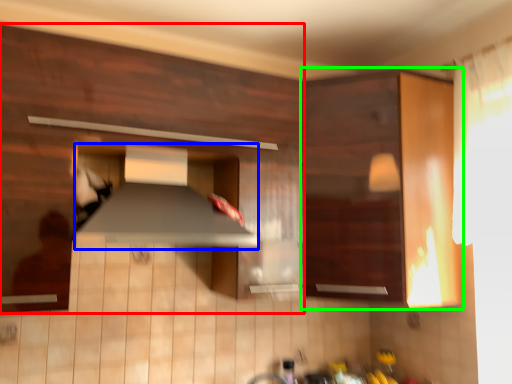
Question: Estimate the real-world distances between objects in this image. Which object is closer to cabinetry (highlighted by a red box), exhaust hood (highlighted by a blue box) or cabinetry (highlighted by a green box)?

Choices:
 (A) exhaust hood
 (B) cabinetry

Answer: (A)